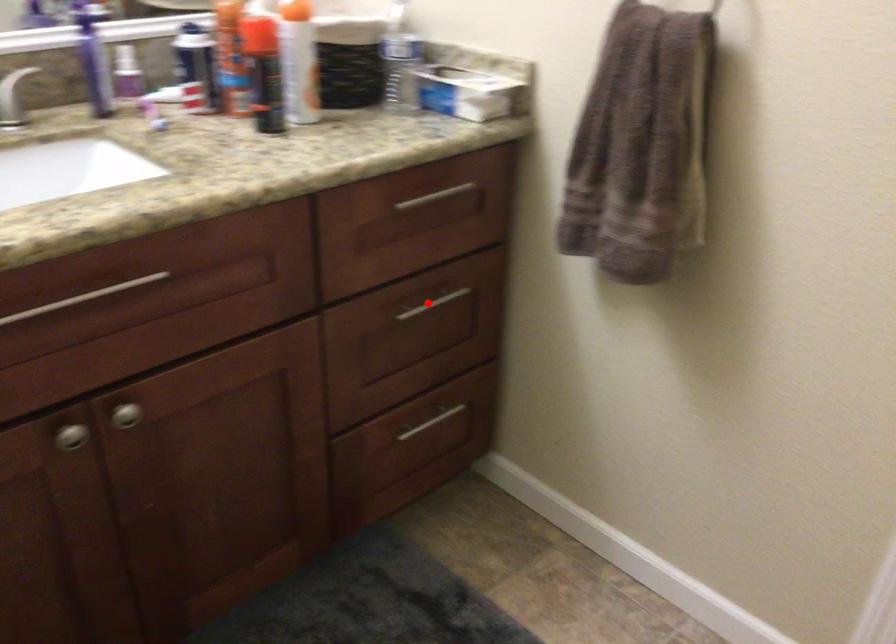
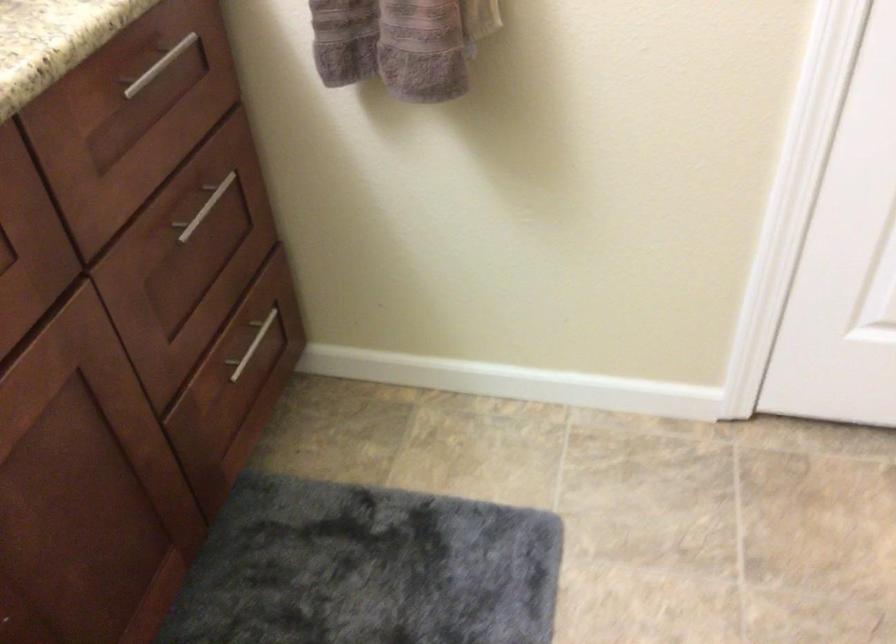
Question: I am providing you with two images of the same scene from different viewpoints. In image1, a red point is highlighted. Considering the same 3D point in image2, which of the following is correct?

Choices:
 (A) It is closer
 (B) It is farther

Answer: (A)